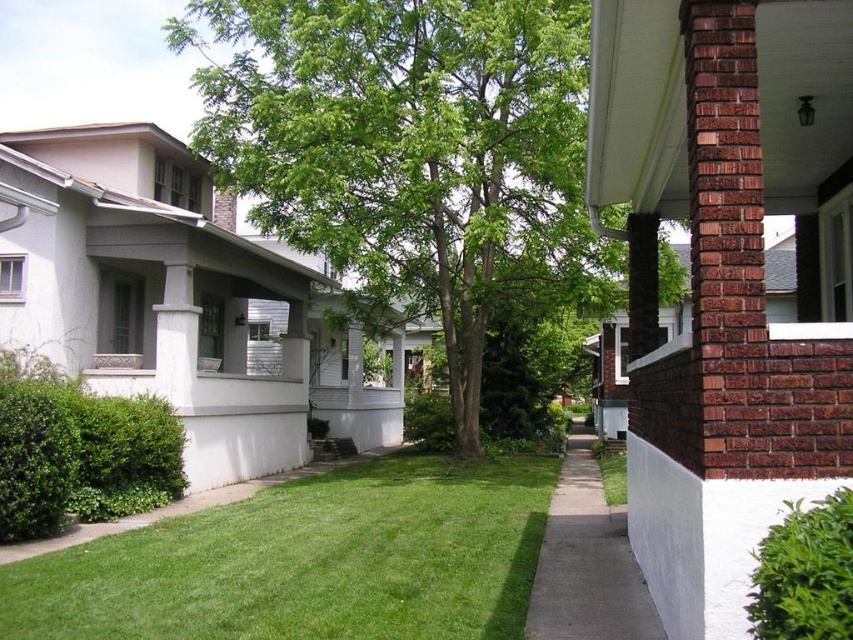
Where is `green grass at lower center`? Image resolution: width=853 pixels, height=640 pixels. green grass at lower center is located at coordinates (309, 561).

Does green grass at lower center come behind gray concrete sidewalk at lower center?

Yes, green grass at lower center is further from the viewer.

Which is behind, point (99, 609) or point (578, 509)?

The point (578, 509) is more distant.

I want to click on green grass at lower center, so click(x=309, y=561).

Consider the image. Can you confirm if green leafy tree at center is smaller than green grass at lower center?

No.

Does green leafy tree at center appear on the right side of green grass at lower center?

Incorrect, green leafy tree at center is not on the right side of green grass at lower center.

Locate an element on the screen. This screenshot has width=853, height=640. green leafy tree at center is located at coordinates (412, 154).

Measure the distance from green leafy tree at center to gray concrete sidewalk at lower center.

green leafy tree at center and gray concrete sidewalk at lower center are 6.88 meters apart.

Does point (521, 220) lie behind point (622, 609)?

Yes, point (521, 220) is behind point (622, 609).

Is point (175, 51) positioned after point (616, 577)?

Yes.

The height and width of the screenshot is (640, 853). What are the coordinates of `green leafy tree at center` in the screenshot? It's located at (412, 154).